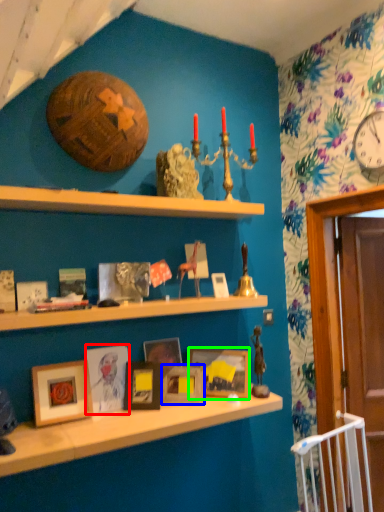
Question: Considering the real-world distances, which object is farthest from picture frame (highlighted by a red box)? picture frame (highlighted by a blue box) or picture frame (highlighted by a green box)?

Choices:
 (A) picture frame
 (B) picture frame

Answer: (B)